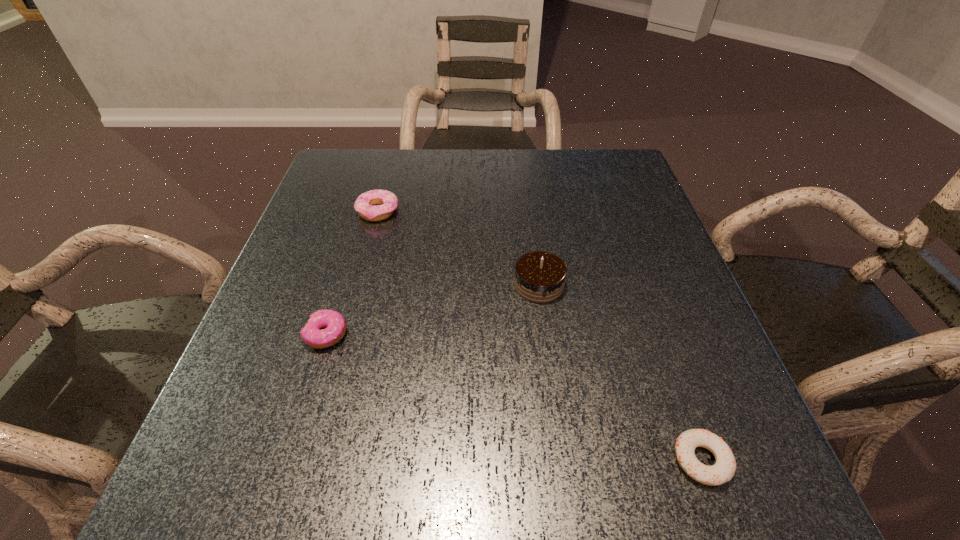
I want to click on object present at the near edge, so click(723, 470).

The image size is (960, 540). I want to click on object that is at the right edge, so click(723, 470).

Image resolution: width=960 pixels, height=540 pixels. What are the coordinates of `object that is positioned at the near right corner` in the screenshot? It's located at (723, 470).

I want to click on vacant space at the far edge of the desktop, so click(x=493, y=155).

Where is `vacant area at the near edge of the desktop`? vacant area at the near edge of the desktop is located at coordinates (430, 483).

In the image, there is a desktop. Identify the location of free space at the left edge. (263, 332).

This screenshot has height=540, width=960. I want to click on blank space at the right edge, so click(678, 263).

Locate an element on the screen. blank space at the far left corner is located at coordinates (331, 170).

Where is `free space at the far right corner`? This screenshot has width=960, height=540. free space at the far right corner is located at coordinates (598, 159).

Find the location of a particular element. vacant space at the near right corner of the desktop is located at coordinates (738, 469).